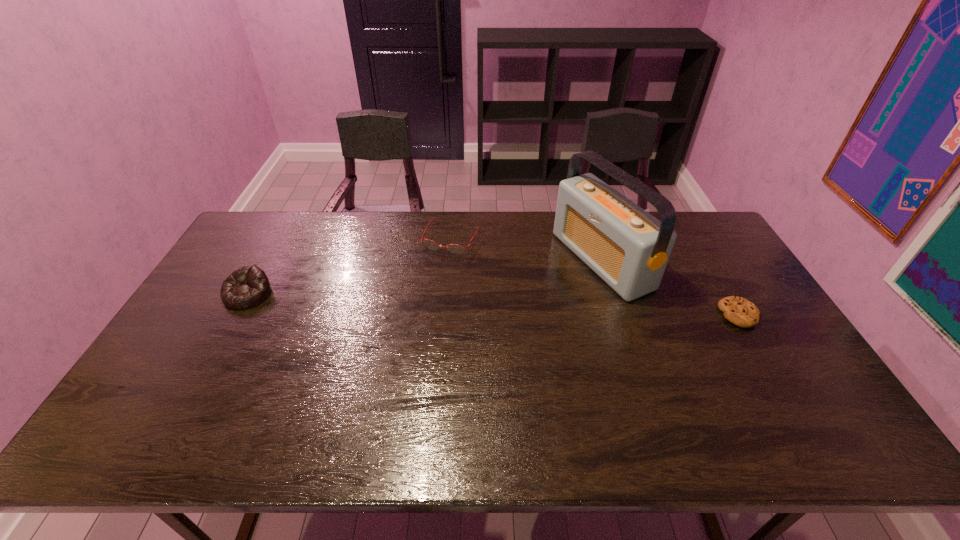
Image resolution: width=960 pixels, height=540 pixels. In the image, there is a desktop. Find the location of `free space at the far edge`. free space at the far edge is located at coordinates (372, 212).

You are a GUI agent. You are given a task and a screenshot of the screen. Output one action in this format:
    pyautogui.click(x=<x>, y=<y>)
    Task: Click on the free location at the near edge of the desktop
    
    Given the screenshot: What is the action you would take?
    pyautogui.click(x=660, y=386)

Where is `vacant space at the right edge of the desktop`? Image resolution: width=960 pixels, height=540 pixels. vacant space at the right edge of the desktop is located at coordinates (759, 301).

At what (x,y) coordinates should I click in order to perform the action: click on vacant space at the far left corner of the desktop. Please return your answer as a coordinate pair (x, y). The image size is (960, 540). Looking at the image, I should click on (281, 226).

This screenshot has height=540, width=960. Find the location of `free space at the far right corner of the desktop`. free space at the far right corner of the desktop is located at coordinates (703, 224).

Locate an element on the screen. free area in between the radio receiver and the beanbag is located at coordinates (424, 278).

The width and height of the screenshot is (960, 540). I want to click on unoccupied area between the third shortest object and the spectacles, so click(x=349, y=266).

Find the location of a particular element. empty space between the third shortest object and the spectacles is located at coordinates (349, 266).

At what (x,y) coordinates should I click in order to perform the action: click on free space that is in between the cookie and the spectacles. Please return your answer as a coordinate pair (x, y). Image resolution: width=960 pixels, height=540 pixels. Looking at the image, I should click on (595, 276).

Identify the location of free area in between the cookie and the spectacles. This screenshot has height=540, width=960. (595, 276).